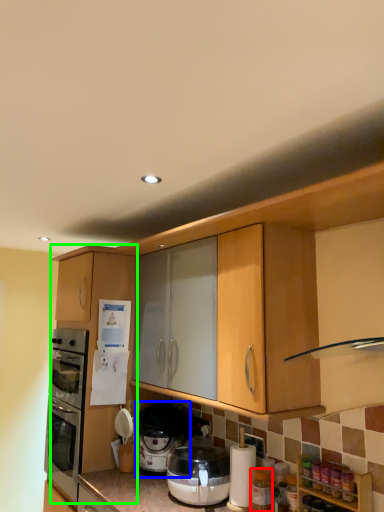
Question: Estimate the real-world distances between objects in this image. Which object is farther from bottle (highlighted by a red box), pressure cooker (highlighted by a blue box) or cabinetry (highlighted by a green box)?

Choices:
 (A) pressure cooker
 (B) cabinetry

Answer: (B)